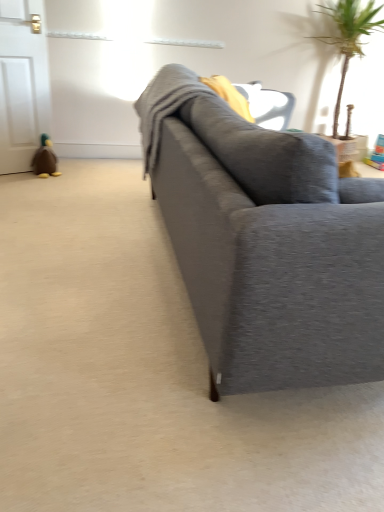
Locate an element on the screen. The image size is (384, 512). free space between matte gray couch at center and brown plush duck at left is located at coordinates (102, 234).